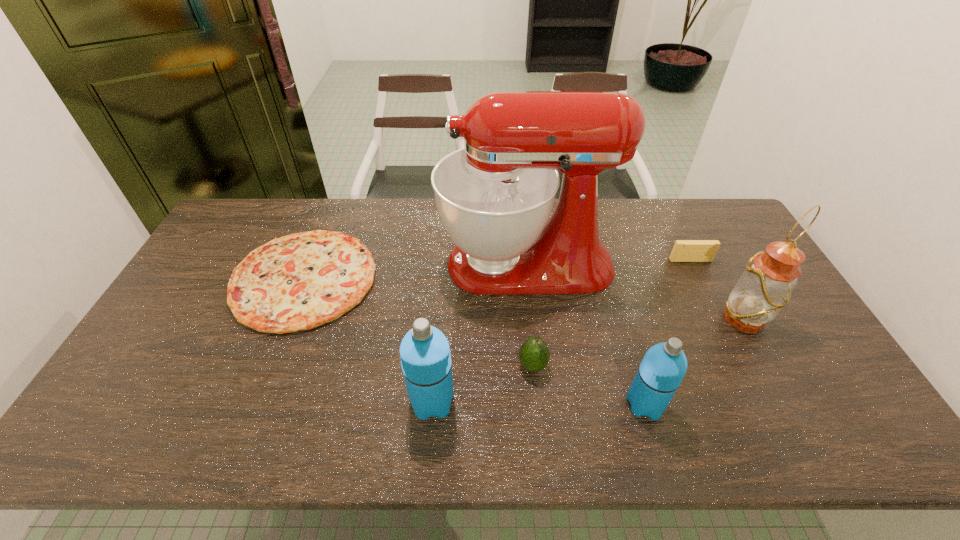
What are the coordinates of `unoccupied area between the third shortest object and the mixer` in the screenshot? It's located at (529, 314).

Locate an element on the screen. The width and height of the screenshot is (960, 540). free spot between the second tallest object and the shortest object is located at coordinates tap(524, 299).

Select which object is the third closest to the oil lamp. Please provide its 2D coordinates. Your answer should be formatted as a tuple, i.e. [(x, y)], where the tuple contains the x and y coordinates of a point satisfying the conditions above.

[(664, 365)]

In order to click on object that is the second closest one to the tallest object in this screenshot , I will do `click(684, 250)`.

The height and width of the screenshot is (540, 960). In order to click on free space that satisfies the following two spatial constraints: 1. on the back side of the third nearest object; 2. on the left side of the third tallest object in this screenshot , I will do `click(435, 366)`.

At what (x,y) coordinates should I click in order to perform the action: click on free spot that satisfies the following two spatial constraints: 1. at the front of the videotape with spools; 2. on the right side of the oil lamp. Please return your answer as a coordinate pair (x, y). The height and width of the screenshot is (540, 960). Looking at the image, I should click on (720, 319).

You are a GUI agent. You are given a task and a screenshot of the screen. Output one action in this format:
    pyautogui.click(x=<x>, y=<y>)
    Task: Click on the vacant space that satisfies the following two spatial constraints: 1. on the back side of the fourth shortest object; 2. at the attachment hub of the mixer
    This screenshot has width=960, height=540.
    Given the screenshot: What is the action you would take?
    pyautogui.click(x=604, y=264)

I want to click on vacant area in the image that satisfies the following two spatial constraints: 1. on the back side of the third tallest object; 2. on the left side of the oil lamp, so click(439, 319).

Identify the location of free point that satisfies the following two spatial constraints: 1. on the back side of the avocado; 2. on the left side of the sixth shortest object. The image size is (960, 540). (528, 319).

Locate an element on the screen. vacant area in the image that satisfies the following two spatial constraints: 1. on the front side of the avocado; 2. on the right side of the shortest object is located at coordinates (269, 366).